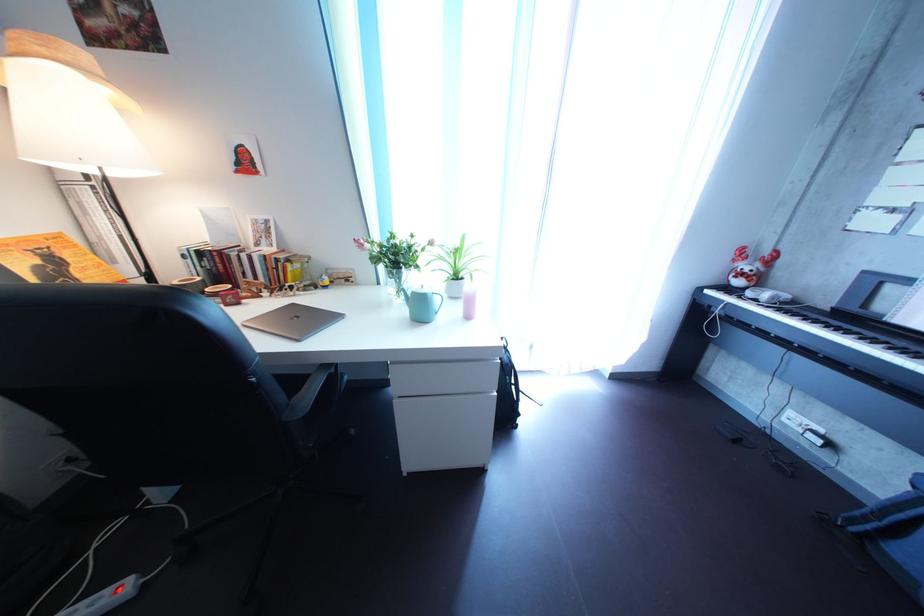
Describe the element at coordinates (444, 413) in the screenshot. I see `the bottom drawer pull` at that location.